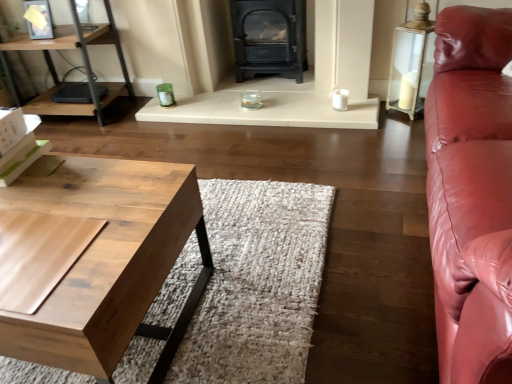
Question: Does wooden desk at left have a larger size compared to matte black wood burning stove at center?

Choices:
 (A) yes
 (B) no

Answer: (A)

Question: Does wooden desk at left have a greater height compared to matte black wood burning stove at center?

Choices:
 (A) yes
 (B) no

Answer: (A)

Question: Are wooden desk at left and matte black wood burning stove at center located far from each other?

Choices:
 (A) no
 (B) yes

Answer: (B)

Question: Is wooden desk at left to the right of matte black wood burning stove at center from the viewer's perspective?

Choices:
 (A) yes
 (B) no

Answer: (B)

Question: From a real-world perspective, is wooden desk at left physically below matte black wood burning stove at center?

Choices:
 (A) yes
 (B) no

Answer: (B)

Question: Is natural wood coffee table at lower left taller or shorter than wooden desk at left?

Choices:
 (A) short
 (B) tall

Answer: (A)

Question: Is natural wood coffee table at lower left inside or outside of wooden desk at left?

Choices:
 (A) inside
 (B) outside

Answer: (B)

Question: From the image's perspective, is natural wood coffee table at lower left positioned above or below wooden desk at left?

Choices:
 (A) below
 (B) above

Answer: (A)

Question: From a real-world perspective, is natural wood coffee table at lower left above or below wooden desk at left?

Choices:
 (A) above
 (B) below

Answer: (B)

Question: From the image's perspective, is natural wood coffee table at lower left above or below matte black wood burning stove at center?

Choices:
 (A) above
 (B) below

Answer: (B)

Question: Is natural wood coffee table at lower left in front of or behind matte black wood burning stove at center in the image?

Choices:
 (A) behind
 (B) front

Answer: (B)

Question: Is point (0, 334) closer or farther from the camera than point (286, 3)?

Choices:
 (A) farther
 (B) closer

Answer: (B)

Question: Looking at their shapes, would you say natural wood coffee table at lower left is wider or thinner than matte black wood burning stove at center?

Choices:
 (A) wide
 (B) thin

Answer: (A)

Question: From the image's perspective, is wooden desk at left positioned above or below matte black wood burning stove at center?

Choices:
 (A) below
 (B) above

Answer: (A)

Question: Looking at their shapes, would you say wooden desk at left is wider or thinner than matte black wood burning stove at center?

Choices:
 (A) wide
 (B) thin

Answer: (A)